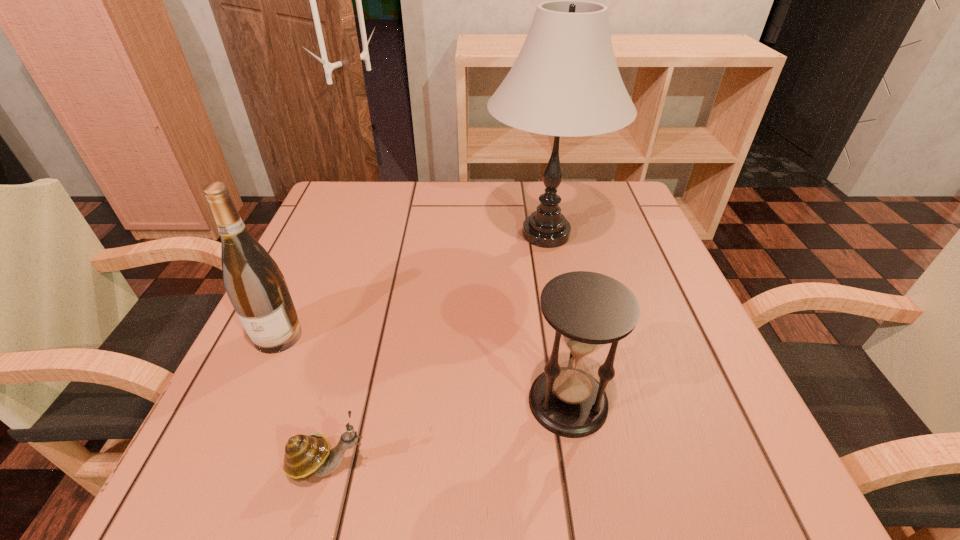
Locate an element on the screen. The height and width of the screenshot is (540, 960). vacant area between the snail and the leftmost object is located at coordinates (302, 400).

The width and height of the screenshot is (960, 540). Find the location of `unoccupied area between the third nearest object and the hourglass`. unoccupied area between the third nearest object and the hourglass is located at coordinates (423, 369).

Locate an element on the screen. Image resolution: width=960 pixels, height=540 pixels. vacant area that lies between the second farthest object and the tallest object is located at coordinates (412, 285).

Locate an element on the screen. This screenshot has width=960, height=540. vacant space that is in between the third tallest object and the third nearest object is located at coordinates (423, 369).

Locate which object ranks third in proximity to the farthest object. Please provide its 2D coordinates. Your answer should be formatted as a tuple, i.e. [(x, y)], where the tuple contains the x and y coordinates of a point satisfying the conditions above.

[(306, 455)]

In order to click on object that can be found as the closest to the third nearest object in this screenshot , I will do `click(306, 455)`.

Find the location of a particular element. The width and height of the screenshot is (960, 540). vacant space that satisfies the following two spatial constraints: 1. on the label of the second shortest object; 2. on the left side of the second tallest object is located at coordinates click(x=249, y=402).

At what (x,y) coordinates should I click in order to perform the action: click on free spot that satisfies the following two spatial constraints: 1. on the label of the second nearest object; 2. on the left side of the wine bottle. Please return your answer as a coordinate pair (x, y). This screenshot has width=960, height=540. Looking at the image, I should click on (249, 402).

This screenshot has height=540, width=960. What are the coordinates of `free region that satisfies the following two spatial constraints: 1. on the label of the wine bottle; 2. on the left side of the third tallest object` in the screenshot? It's located at (249, 402).